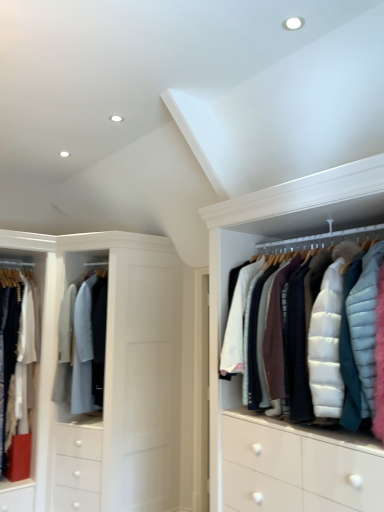
Question: Is white puffy jacket at upper right beside light gray wool coat at center, positioned as the 2th clothing in left-to-right order?

Choices:
 (A) yes
 (B) no

Answer: (B)

Question: Can you confirm if white puffy jacket at upper right is bigger than light gray wool coat at center, positioned as the 2th clothing in left-to-right order?

Choices:
 (A) no
 (B) yes

Answer: (B)

Question: From a real-world perspective, is white puffy jacket at upper right below light gray wool coat at center, placed as the 1th clothing when sorted from right to left?

Choices:
 (A) yes
 (B) no

Answer: (B)

Question: Would you say white puffy jacket at upper right is outside light gray wool coat at center, placed as the 1th clothing when sorted from right to left?

Choices:
 (A) yes
 (B) no

Answer: (A)

Question: Does white puffy jacket at upper right have a greater height compared to light gray wool coat at center, placed as the 1th clothing when sorted from right to left?

Choices:
 (A) no
 (B) yes

Answer: (A)

Question: Is white puffy jacket at upper right closer to camera compared to light gray wool coat at center, placed as the 1th clothing when sorted from right to left?

Choices:
 (A) yes
 (B) no

Answer: (A)

Question: Can you confirm if white cotton shirt at left, the 1th clothing from the left, is wider than light gray wool coat at center, positioned as the 2th clothing in left-to-right order?

Choices:
 (A) yes
 (B) no

Answer: (B)

Question: Is light gray wool coat at center, positioned as the 2th clothing in left-to-right order, located within white cotton shirt at left, the 1th clothing from the left?

Choices:
 (A) yes
 (B) no

Answer: (B)

Question: Is white cotton shirt at left, the 1th clothing from the left, further to camera compared to light gray wool coat at center, placed as the 1th clothing when sorted from right to left?

Choices:
 (A) no
 (B) yes

Answer: (A)

Question: Is white cotton shirt at left, the second clothing in the right-to-left sequence, positioned far away from light gray wool coat at center, positioned as the 2th clothing in left-to-right order?

Choices:
 (A) no
 (B) yes

Answer: (A)

Question: Would you say white cotton shirt at left, the second clothing in the right-to-left sequence, is outside light gray wool coat at center, placed as the 1th clothing when sorted from right to left?

Choices:
 (A) yes
 (B) no

Answer: (A)

Question: Is white cotton shirt at left, the second clothing in the right-to-left sequence, touching light gray wool coat at center, placed as the 1th clothing when sorted from right to left?

Choices:
 (A) yes
 (B) no

Answer: (B)

Question: Is white cotton shirt at left, the second clothing in the right-to-left sequence, a part of light gray wool coat at center, positioned as the 2th clothing in left-to-right order?

Choices:
 (A) no
 (B) yes

Answer: (A)